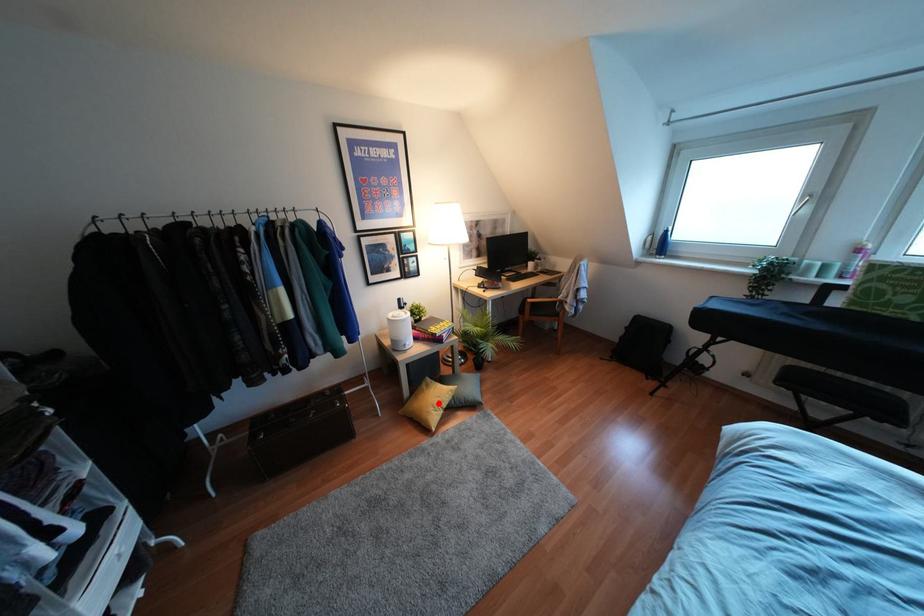
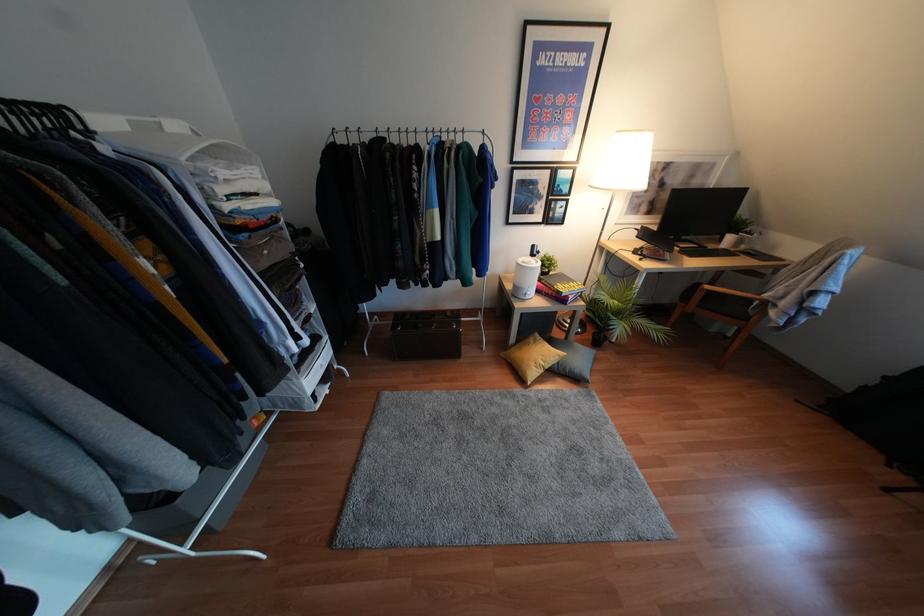
Question: I am providing you with two images of the same scene from different viewpoints. Image1 has a red point marked. In image2, the corresponding 3D location appears at what relative position? Reply with the corresponding letter.

Choices:
 (A) Closer
 (B) Farther

Answer: (B)